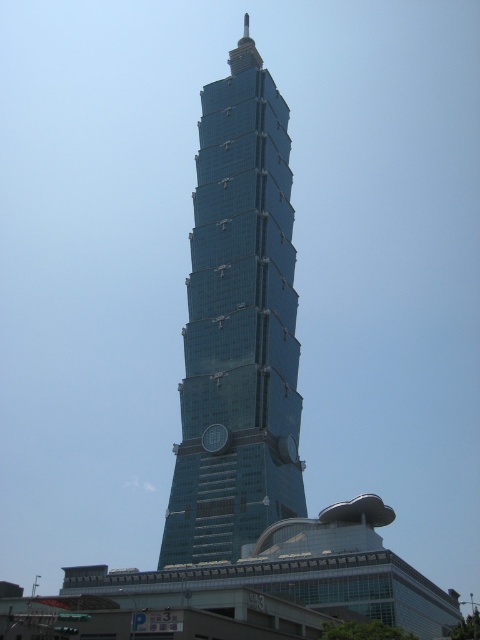
Does point (266, 186) come closer to viewer compared to point (292, 440)?

That is False.

Which is behind, point (225, 228) or point (288, 449)?

The point (225, 228) is more distant.

Between point (241, 154) and point (292, 451), which one is positioned behind?

The point (241, 154) is more distant.

Image resolution: width=480 pixels, height=640 pixels. What are the coordinates of `glassy blue skyscraper at center` in the screenshot? It's located at (238, 324).

Which is in front, point (211, 440) or point (289, 461)?

Point (211, 440) is in front.

Does metallic clock at center have a lesser height compared to metallic silver clock at center?

Yes.

Identify the location of metallic clock at center. The width and height of the screenshot is (480, 640). (216, 438).

Does point (201, 428) come behind point (207, 444)?

Yes, point (201, 428) is farther from viewer.

Is point (236, 65) more distant than point (219, 428)?

Yes, it is behind point (219, 428).

Where is `glassy blue skyscraper at center`? glassy blue skyscraper at center is located at coordinates (238, 324).